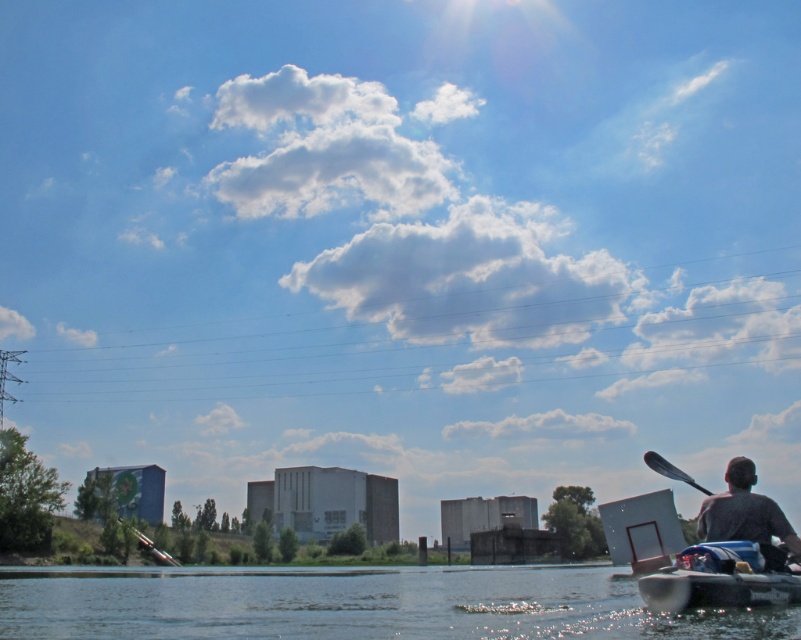
Is clear water at lower center shorter than white plastic boat at lower right?

In fact, clear water at lower center may be taller than white plastic boat at lower right.

Is clear water at lower center positioned in front of white plastic boat at lower right?

Yes, clear water at lower center is closer to the viewer.

Locate an element on the screen. Image resolution: width=801 pixels, height=640 pixels. clear water at lower center is located at coordinates (353, 604).

In the scene shown: Who is more forward, (773,577) or (751,476)?

Point (773,577) is more forward.

Can you confirm if white plastic boat at lower right is positioned above dark gray fabric at lower right?

Yes, white plastic boat at lower right is above dark gray fabric at lower right.

Who is more forward, (x=671, y=611) or (x=731, y=538)?

Point (x=671, y=611)

Where is `white plastic boat at lower right`? white plastic boat at lower right is located at coordinates (719, 579).

Between clear water at lower center and black plastic paddle at lower right, which one has less height?

With less height is clear water at lower center.

Who is positioned more to the right, clear water at lower center or black plastic paddle at lower right?

From the viewer's perspective, black plastic paddle at lower right appears more on the right side.

You are a GUI agent. You are given a task and a screenshot of the screen. Output one action in this format:
    pyautogui.click(x=<x>, y=<y>)
    Task: Click on the clear water at lower center
    This screenshot has height=640, width=801.
    Given the screenshot: What is the action you would take?
    pyautogui.click(x=353, y=604)